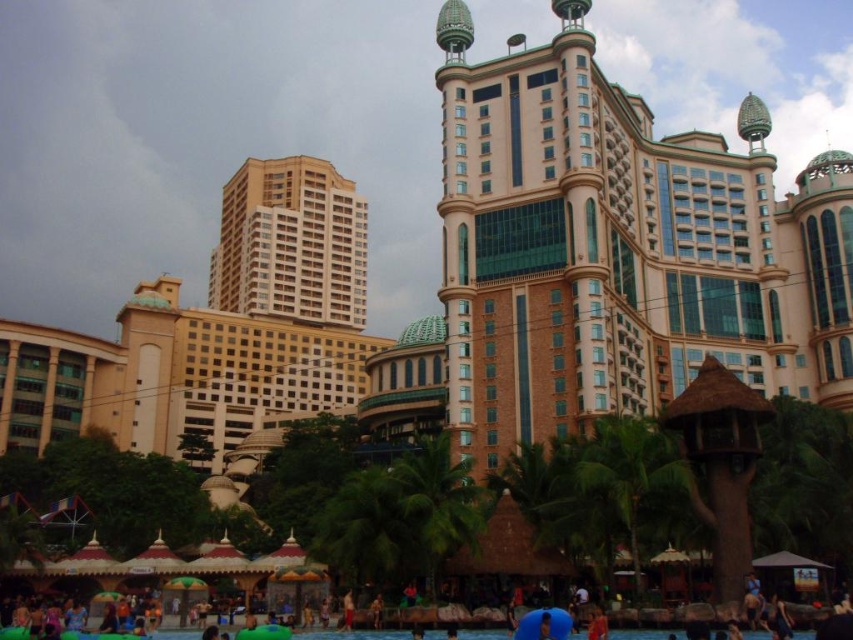
Who is more forward, (328, 216) or (198, 634)?

Point (198, 634)

Is beige glass building at center smaller than blue rubber pool at lower center?

Actually, beige glass building at center might be larger than blue rubber pool at lower center.

Between point (337, 284) and point (328, 634), which one is positioned behind?

The point (337, 284) is more distant.

Locate an element on the screen. beige glass building at center is located at coordinates (291, 243).